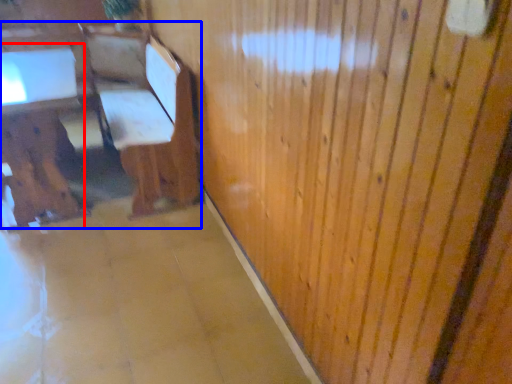
Question: Which object is further to the camera taking this photo, table (highlighted by a red box) or furniture (highlighted by a blue box)?

Choices:
 (A) table
 (B) furniture

Answer: (A)